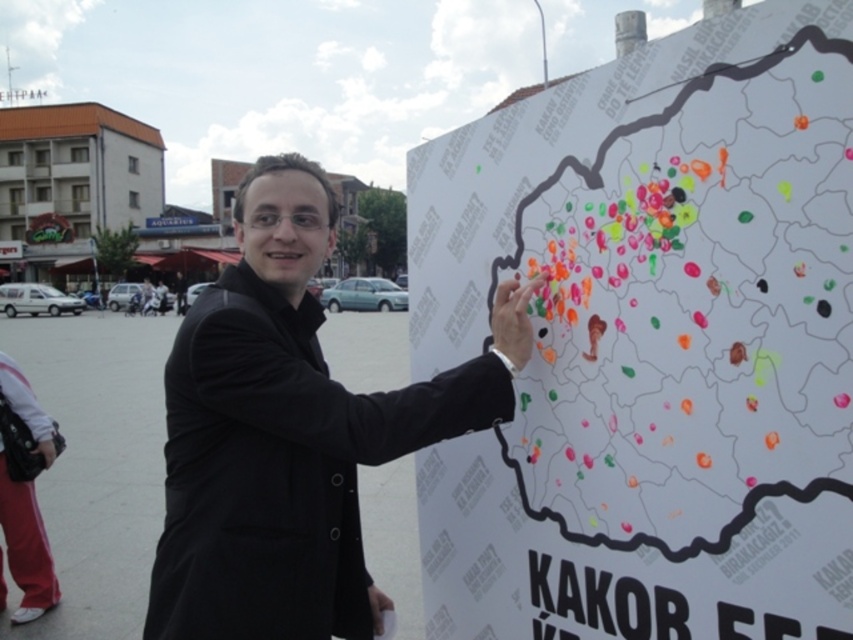
Which of these two, white paper map at center or black matte coat at center, stands shorter?

black matte coat at center is shorter.

Does point (692, 328) lie behind point (401, 436)?

No, (692, 328) is in front of (401, 436).

What do you see at coordinates (650, 342) in the screenshot? The image size is (853, 640). I see `white paper map at center` at bounding box center [650, 342].

The width and height of the screenshot is (853, 640). I want to click on white paper map at center, so click(650, 342).